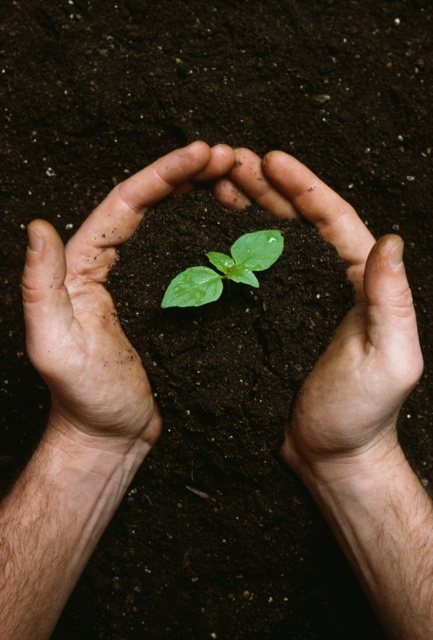
Question: Where is smooth skin hands at center located in relation to green glossy leaf at center in the image?

Choices:
 (A) right
 (B) left

Answer: (B)

Question: Is smooth skin hands at center wider than green glossy leaf at center?

Choices:
 (A) no
 (B) yes

Answer: (B)

Question: Among these objects, which one is farthest from the camera?

Choices:
 (A) green glossy leaf at center
 (B) smooth skin hands at center

Answer: (A)

Question: Can you confirm if smooth skin hands at center is smaller than green glossy leaf at center?

Choices:
 (A) no
 (B) yes

Answer: (A)

Question: Which object appears farthest from the camera in this image?

Choices:
 (A) green glossy leaf at center
 (B) smooth skin hands at center

Answer: (A)